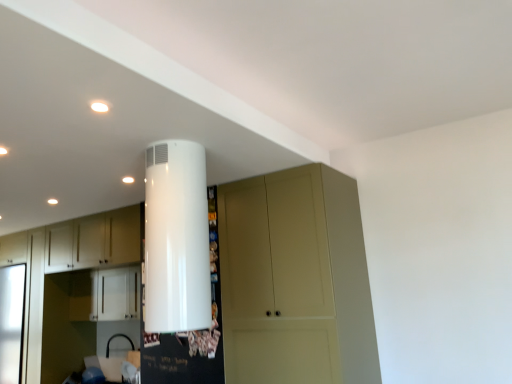
Question: From a real-world perspective, is white matte cabinet at left, the first cabinetry when ordered from left to right, physically below white glossy water heater at upper center?

Choices:
 (A) no
 (B) yes

Answer: (B)

Question: Is white matte cabinet at left, marked as the second cabinetry in a right-to-left arrangement, further to the viewer compared to white glossy water heater at upper center?

Choices:
 (A) yes
 (B) no

Answer: (A)

Question: Could you tell me if white matte cabinet at left, the first cabinetry when ordered from left to right, is facing white glossy water heater at upper center?

Choices:
 (A) yes
 (B) no

Answer: (B)

Question: Is white matte cabinet at left, the first cabinetry when ordered from left to right, oriented away from white glossy water heater at upper center?

Choices:
 (A) yes
 (B) no

Answer: (B)

Question: Considering the relative sizes of white matte cabinet at left, marked as the second cabinetry in a right-to-left arrangement, and white glossy water heater at upper center in the image provided, is white matte cabinet at left, marked as the second cabinetry in a right-to-left arrangement, bigger than white glossy water heater at upper center?

Choices:
 (A) no
 (B) yes

Answer: (B)

Question: Based on their sizes in the image, would you say white glossy water heater at upper center is bigger or smaller than white glossy cabinet at center, which is the 1th cabinetry in right-to-left order?

Choices:
 (A) big
 (B) small

Answer: (B)

Question: From the image's perspective, is white glossy water heater at upper center above or below white glossy cabinet at center, the 2th cabinetry viewed from the left?

Choices:
 (A) below
 (B) above

Answer: (B)

Question: From a real-world perspective, relative to white glossy cabinet at center, the 2th cabinetry viewed from the left, is white glossy water heater at upper center vertically above or below?

Choices:
 (A) below
 (B) above

Answer: (B)

Question: Visually, is white glossy water heater at upper center positioned to the left or to the right of white glossy cabinet at center, which is the 1th cabinetry in right-to-left order?

Choices:
 (A) right
 (B) left

Answer: (A)

Question: Is white matte cabinet at left, the first cabinetry when ordered from left to right, wider or thinner than matte beige cupboard at center?

Choices:
 (A) wide
 (B) thin

Answer: (B)

Question: From the image's perspective, relative to matte beige cupboard at center, is white matte cabinet at left, the first cabinetry when ordered from left to right, above or below?

Choices:
 (A) below
 (B) above

Answer: (A)

Question: Based on their positions, is white matte cabinet at left, the first cabinetry when ordered from left to right, located to the left or right of matte beige cupboard at center?

Choices:
 (A) right
 (B) left

Answer: (B)

Question: Is point (105, 266) positioned closer to the camera than point (228, 296)?

Choices:
 (A) farther
 (B) closer

Answer: (A)

Question: From a real-world perspective, is matte beige cupboard at center above or below white matte cabinet at left, the first cabinetry when ordered from left to right?

Choices:
 (A) above
 (B) below

Answer: (A)

Question: Is matte beige cupboard at center situated inside white matte cabinet at left, the first cabinetry when ordered from left to right, or outside?

Choices:
 (A) outside
 (B) inside

Answer: (A)